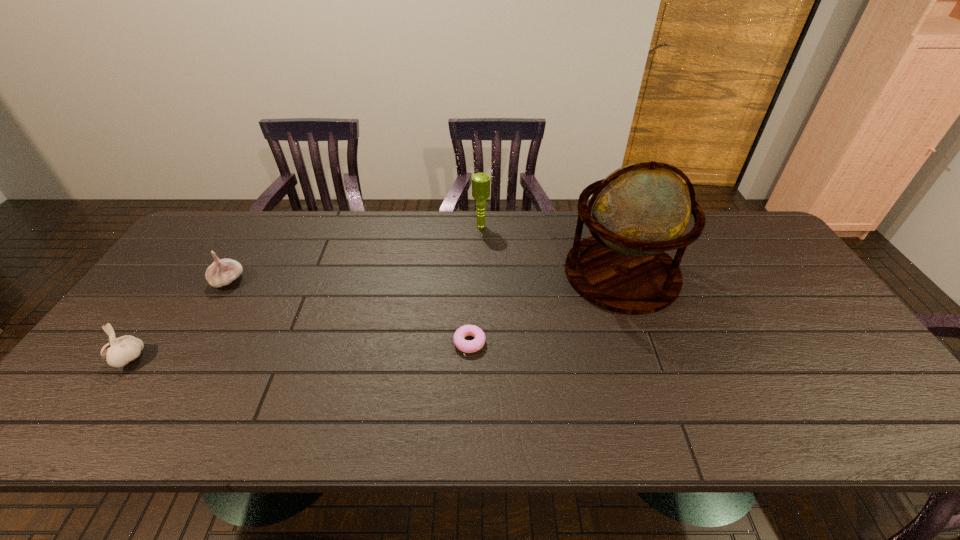
The image size is (960, 540). I want to click on the rightmost object, so click(641, 210).

Locate an element on the screen. The height and width of the screenshot is (540, 960). the tallest object is located at coordinates (641, 210).

Where is `the farthest object`? The width and height of the screenshot is (960, 540). the farthest object is located at coordinates (480, 181).

Where is `microphone`? Image resolution: width=960 pixels, height=540 pixels. microphone is located at coordinates (480, 181).

I want to click on the right garlic, so click(222, 272).

Where is `the farther garlic`? The height and width of the screenshot is (540, 960). the farther garlic is located at coordinates (222, 272).

Where is `the left garlic`? the left garlic is located at coordinates (120, 351).

At what (x,y) coordinates should I click in order to perform the action: click on the leftmost object. Please return your answer as a coordinate pair (x, y). The width and height of the screenshot is (960, 540). Looking at the image, I should click on (120, 351).

Where is `the shortest object`? The height and width of the screenshot is (540, 960). the shortest object is located at coordinates (476, 344).

Identify the location of vacant space located 0.220m on the front-facing side of the globe. This screenshot has width=960, height=540. (492, 273).